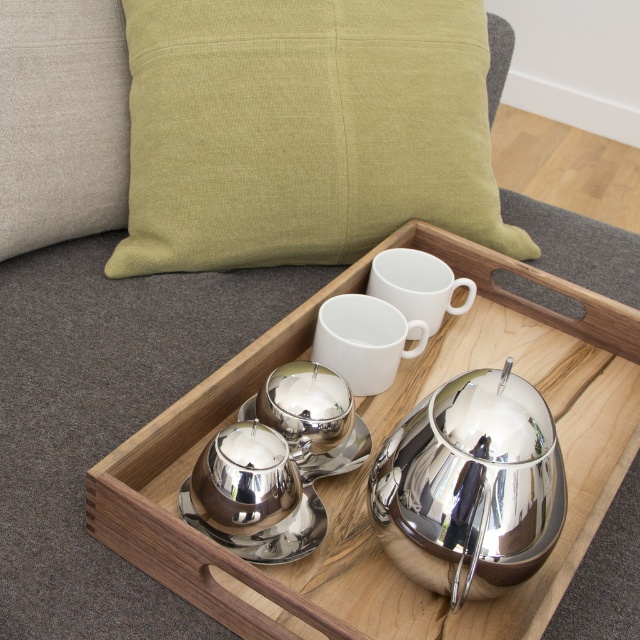
Question: Does polished silver tea pot at center have a lesser width compared to white matte cup at center?

Choices:
 (A) no
 (B) yes

Answer: (B)

Question: Is green fabric cushion at upper center smaller than polished silver tray at center?

Choices:
 (A) no
 (B) yes

Answer: (B)

Question: Among these objects, which one is nearest to the camera?

Choices:
 (A) polished silver tray at center
 (B) green fabric cushion at upper center
 (C) polished metallic tea pot at center

Answer: (C)

Question: Where is white glossy mug at center located in relation to white matte cup at center in the image?

Choices:
 (A) above
 (B) below

Answer: (B)

Question: Which object is farther from the camera taking this photo?

Choices:
 (A) white glossy mug at center
 (B) polished metallic tea pot at center

Answer: (A)

Question: Which point is farther to the camera?

Choices:
 (A) (385, 166)
 (B) (256, 518)

Answer: (A)